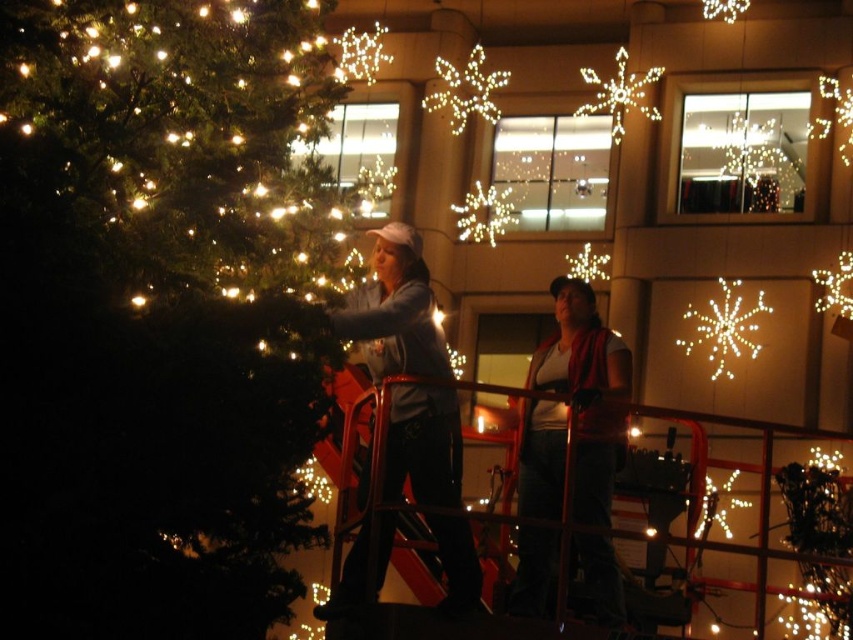
You are standing in front of the festive scene with the illuminated matte green tree at left and the illuminated plastic snowflake at upper center. Which object is nearer to you?

The illuminated matte green tree at left is closer to the viewer than the illuminated plastic snowflake at upper center.

You are a photographer trying to capture the festive scene. You need to ensure that both the illuminated matte green tree at left and the matte white tank top at center are clearly visible in your photo. Given their sizes, which object should you focus on first to ensure proper exposure?

The illuminated matte green tree at left is larger in size than the matte white tank top at center, so you should focus on the illuminated matte green tree at left first to ensure proper exposure since it occupies more of the frame and requires accurate lighting adjustment.

You are standing at the center of the image and want to place a new decoration between the illuminated matte green tree at left and the illuminated plastic snowflake at upper center. Which direction should you move to reach the midpoint between them?

The illuminated matte green tree at left is positioned on the left side of the illuminated plastic snowflake at upper center. To reach the midpoint between them, you should move towards the left of the snowflake or the right of the tree to place the decoration between them.